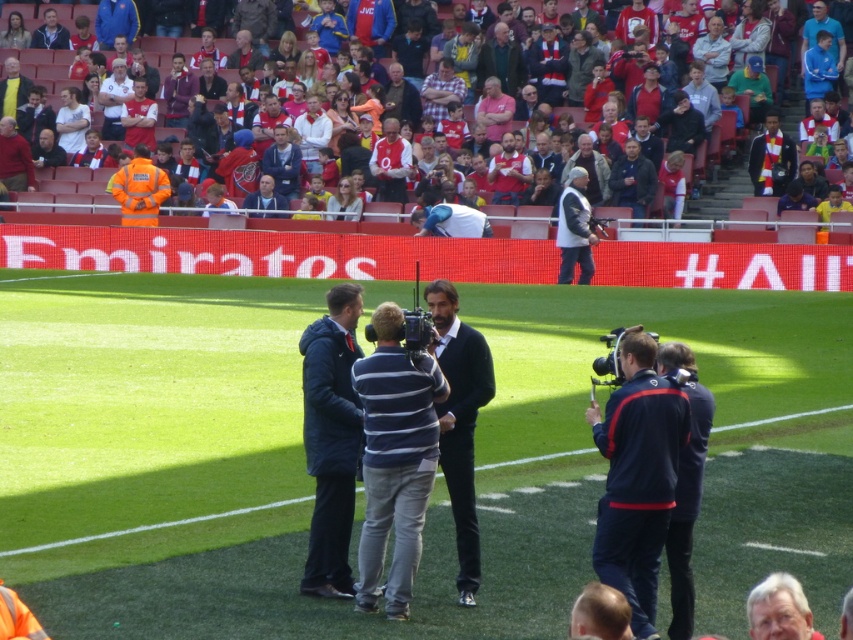
You are a photographer positioned at the back of the stadium. You want to take a photo of the dark blue fabric jacket at right and the dark gray leather jacket at center. Can you see both jackets clearly in your frame?

The dark blue fabric jacket at right is in front of the dark gray leather jacket at center, so the dark blue fabric jacket at right may block part of the dark gray leather jacket at center in your photo.

You are a photographer at the stadium and need to determine which of the two dark blue items is better suited for a wide shot focusing on the crowd. Since the dark blue fabric jacket at right is larger in size than the dark blue sweater at center, which one would be more visible in the shot?

The dark blue fabric jacket at right is larger in size than the dark blue sweater at center, so it would be more visible in the wide shot focusing on the crowd.

You are a photographer at the stadium and need to capture a wide shot of the sports event. You notice the dark blue fabric jacket at right and the white jersey at center. Which object should you focus on to ensure it takes up more space in your photo?

The white jersey at center should be focused on because it occupies more space than the dark blue fabric jacket at right, as stated in the description.